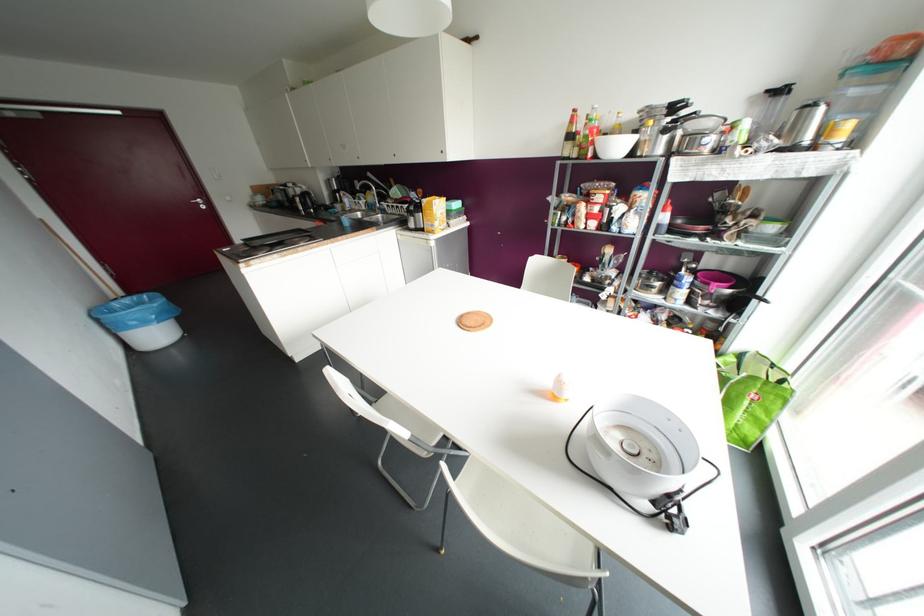
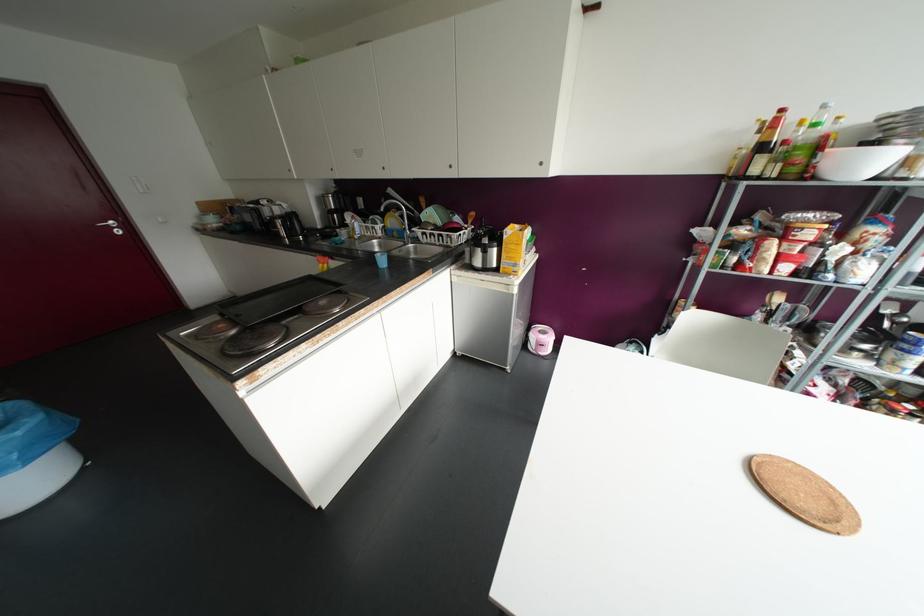
The point at (202, 207) is marked in the first image. Where is the corresponding point in the second image?

(117, 232)